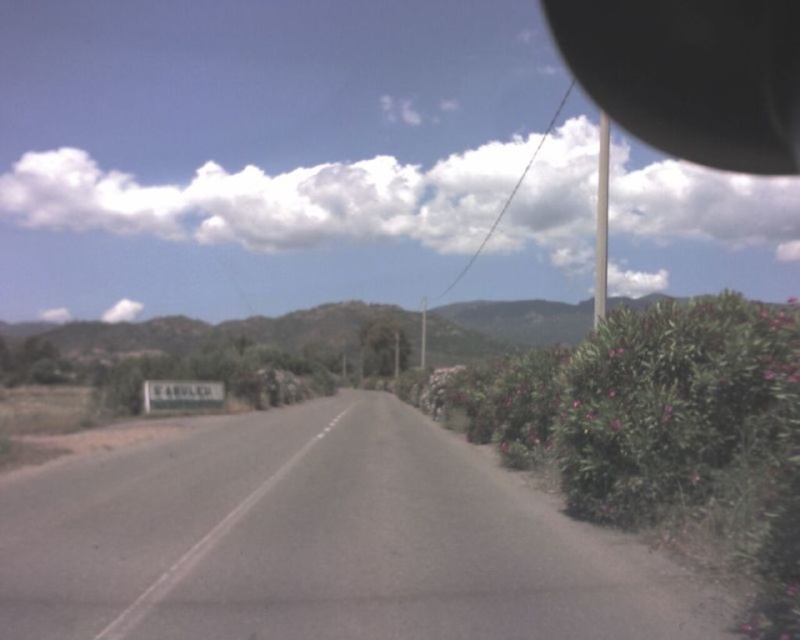
Looking at this image, you are standing at the starting point of the road and want to walk to the end of the asphalt road at center. According to the coordinates given, in which direction should you head?

The asphalt road at center is located at coordinates point (322, 541). Since you are at the starting point, you should head towards the coordinates provided, which would be forward along the road as it stretches straight ahead.

You are driving a car and see the asphalt road at center and the black rubber view mirror at upper right. Which object is located to the left of the other?

The asphalt road at center is positioned on the left side of black rubber view mirror at upper right.